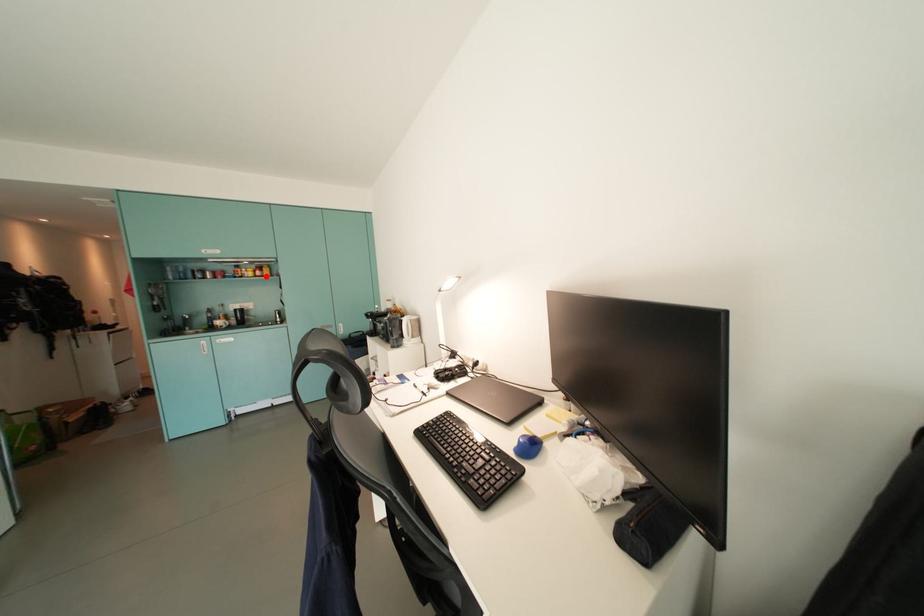
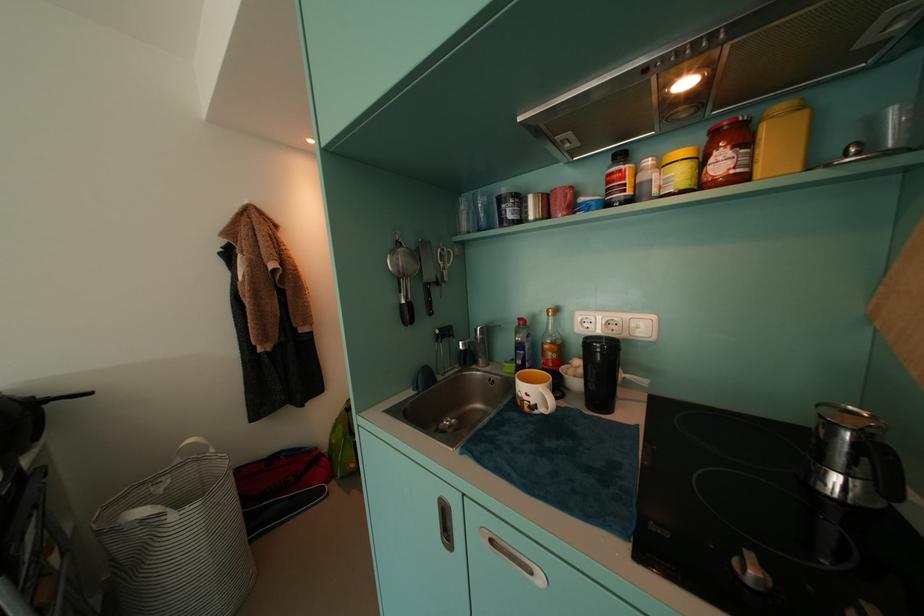
Where in the second image is the point corresponding to the highlighted location from the first image?

(730, 166)